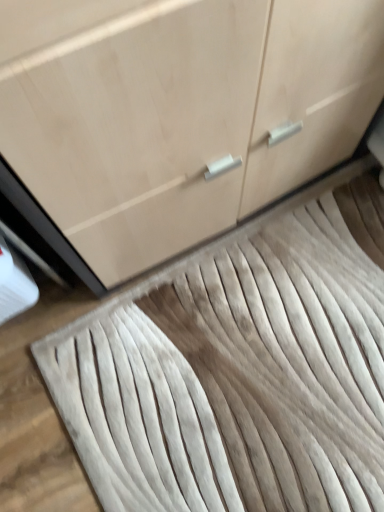
This screenshot has width=384, height=512. What are the coordinates of `free spot below white textured rug at center (from a real-world perspective)` in the screenshot? It's located at (260, 355).